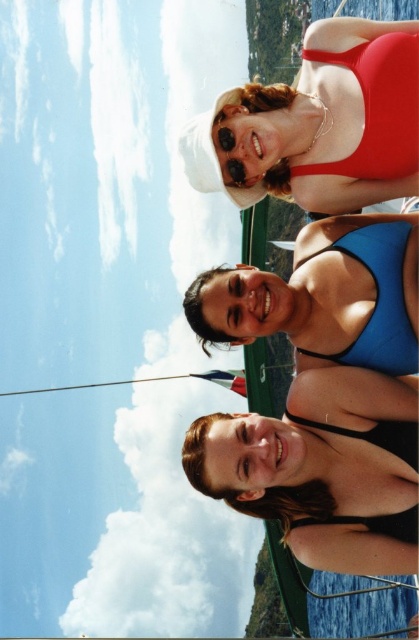
You are standing on the deck of a boat and see the black matte swimsuit at lower center. If you want to throw a life preserver to them, which is 100 feet in range, will it reach?

The black matte swimsuit at lower center and viewer are 182.28 feet apart, so the life preserver with a 100 feet range cannot reach them.

You are standing on the boat and want to move from point A to point B. Point A is at coordinates point (395,387) and point B is at coordinates point (253,337). Since you are facing the front of the boat, which direction should you move to reach point B from point A?

Since point (395,387) is in front of point (253,337), you should move backward to reach point B from point A.